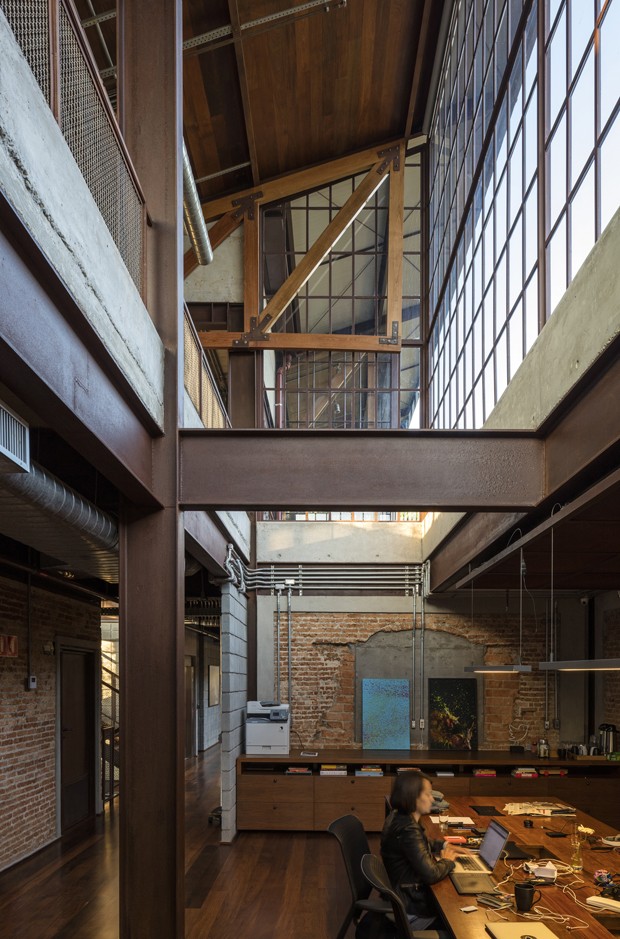
Image resolution: width=620 pixels, height=939 pixels. In order to click on pillar in this screenshot , I will do click(x=160, y=816).